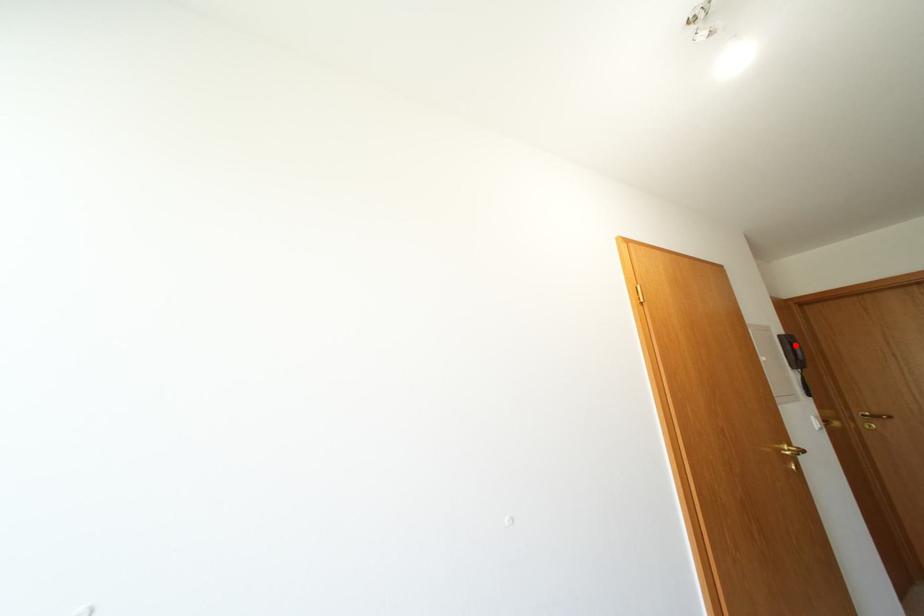
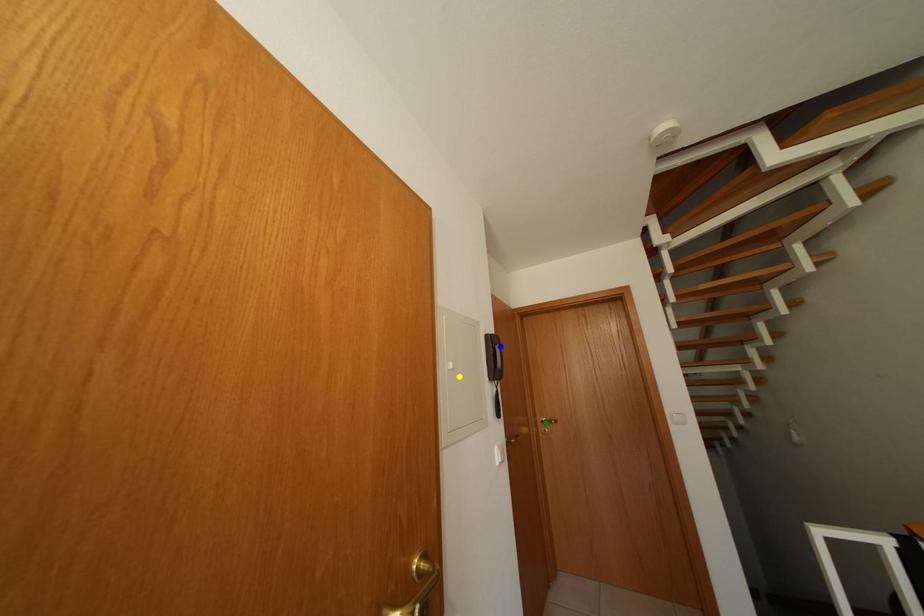
Question: I am providing you with two images of the same scene from different viewpoints. A red point is marked on the first image. You are given multiple points on the second image. In image 2, which mark is for the same physical point as the one in image 1?

Choices:
 (A) blue point
 (B) yellow point
 (C) green point

Answer: (A)